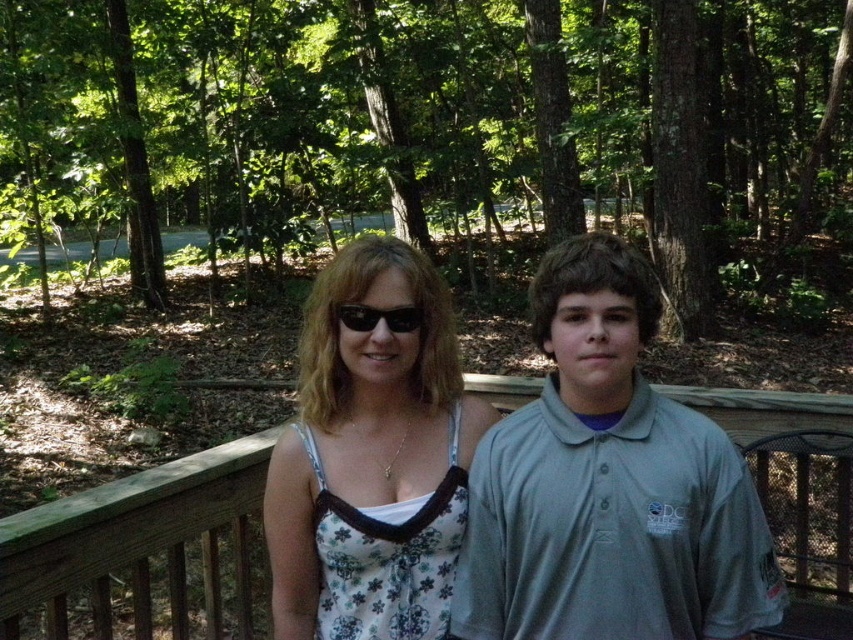
Between point (631, 328) and point (378, 308), which one is positioned behind?

The point (378, 308) is more distant.

How much distance is there between gray cotton polo shirt at center and black plastic sunglasses at center?

gray cotton polo shirt at center and black plastic sunglasses at center are 35.58 centimeters apart.

Between point (523, 611) and point (402, 317), which one is positioned behind?

The point (402, 317) is behind.

Identify the location of gray cotton polo shirt at center. This screenshot has width=853, height=640. [x=608, y=484].

Measure the distance between point (416, 596) and camera.

Point (416, 596) is 5.26 feet from camera.

Based on the photo, is white floral dress at center wider than black plastic sunglasses at center?

Yes.

Where is `white floral dress at center`? The width and height of the screenshot is (853, 640). white floral dress at center is located at coordinates (370, 458).

Does gray cotton polo shirt at center appear on the left side of white floral dress at center?

No, gray cotton polo shirt at center is not to the left of white floral dress at center.

Is gray cotton polo shirt at center taller than white floral dress at center?

In fact, gray cotton polo shirt at center may be shorter than white floral dress at center.

Locate an element on the screen. gray cotton polo shirt at center is located at coordinates (608, 484).